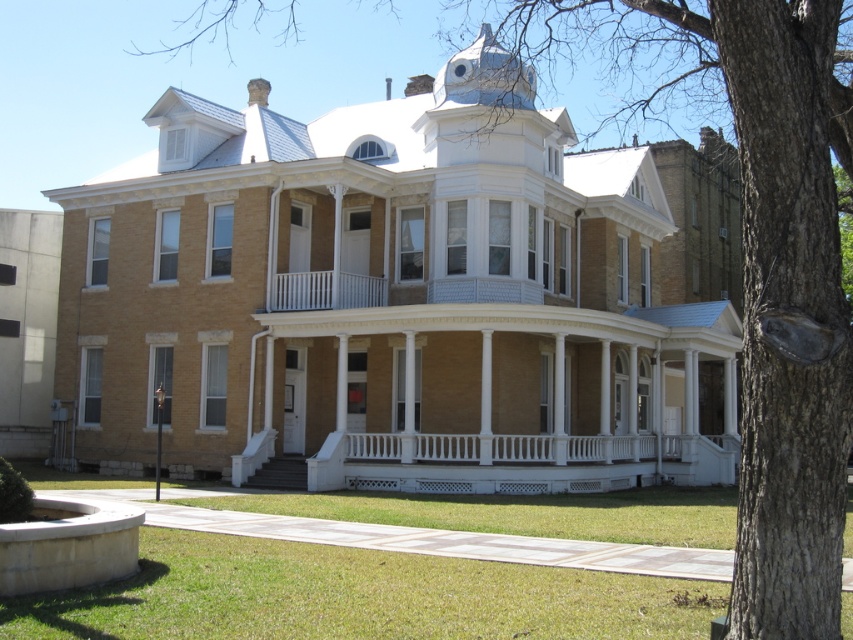
You are standing in front of the house and want to walk towards the white painted wood porch at center. Which direction should you move relative to the green grass at lower center?

To reach the white painted wood porch at center, you should move backward away from the green grass at lower center since the green grass at lower center is in front of the white painted wood porch at center.

You are a gardener planning to mow the green grass at lower center and the white painted wood porch at center. Which area requires a wider mower path?

The white painted wood porch at center requires a wider mower path because the green grass at lower center has a lesser width compared to it.

You are standing on the porch of the Victorian house and want to place a decorative planter. The planter needs to be placed on the green grass at lower center. According to the coordinates provided, where exactly should you position the planter?

The green grass at lower center is located at point (354, 596), so you should position the planter at those coordinates.